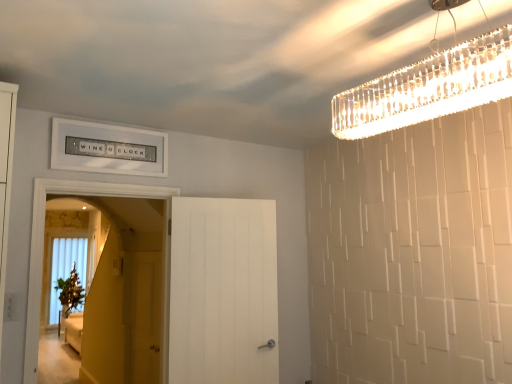
Question: Is clear crystal chandelier at upper right at the back of white wooden door at left, the 2th door from the right?

Choices:
 (A) yes
 (B) no

Answer: (B)

Question: From the image's perspective, does white wooden door at left, which is counted as the 1th door, starting from the left, appear lower than clear crystal chandelier at upper right?

Choices:
 (A) no
 (B) yes

Answer: (B)

Question: From the image's perspective, would you say white wooden door at left, which is counted as the 1th door, starting from the left, is positioned over clear crystal chandelier at upper right?

Choices:
 (A) yes
 (B) no

Answer: (B)

Question: Can you confirm if white wooden door at left, the 2th door from the right, is wider than clear crystal chandelier at upper right?

Choices:
 (A) yes
 (B) no

Answer: (A)

Question: Considering the relative positions of white wooden door at left, the 2th door from the right, and clear crystal chandelier at upper right in the image provided, is white wooden door at left, the 2th door from the right, to the right of clear crystal chandelier at upper right from the viewer's perspective?

Choices:
 (A) yes
 (B) no

Answer: (B)

Question: In the image, is matte yellow screen door at center on the left side or the right side of clear crystal chandelier at upper right?

Choices:
 (A) right
 (B) left

Answer: (B)

Question: Choose the correct answer: Is matte yellow screen door at center inside clear crystal chandelier at upper right or outside it?

Choices:
 (A) inside
 (B) outside

Answer: (B)

Question: In terms of size, does matte yellow screen door at center appear bigger or smaller than clear crystal chandelier at upper right?

Choices:
 (A) small
 (B) big

Answer: (A)

Question: Is matte yellow screen door at center taller or shorter than clear crystal chandelier at upper right?

Choices:
 (A) short
 (B) tall

Answer: (B)

Question: In the image, is white matte door at center, the 2th door positioned from the left, on the left side or the right side of white wooden door at left, which is counted as the 1th door, starting from the left?

Choices:
 (A) right
 (B) left

Answer: (A)

Question: Looking at their shapes, would you say white matte door at center, positioned as the 1th door in right-to-left order, is wider or thinner than white wooden door at left, the 2th door from the right?

Choices:
 (A) wide
 (B) thin

Answer: (B)

Question: Does point (187, 319) appear closer or farther from the camera than point (117, 190)?

Choices:
 (A) closer
 (B) farther

Answer: (B)

Question: In terms of size, does white matte door at center, the 2th door positioned from the left, appear bigger or smaller than white wooden door at left, the 2th door from the right?

Choices:
 (A) big
 (B) small

Answer: (B)

Question: Considering the relative positions of white wooden door at left, the 2th door from the right, and white matte door at center, positioned as the 1th door in right-to-left order, in the image provided, is white wooden door at left, the 2th door from the right, to the left or to the right of white matte door at center, positioned as the 1th door in right-to-left order,?

Choices:
 (A) right
 (B) left

Answer: (B)

Question: Is point (145, 196) positioned closer to the camera than point (203, 342)?

Choices:
 (A) farther
 (B) closer

Answer: (A)